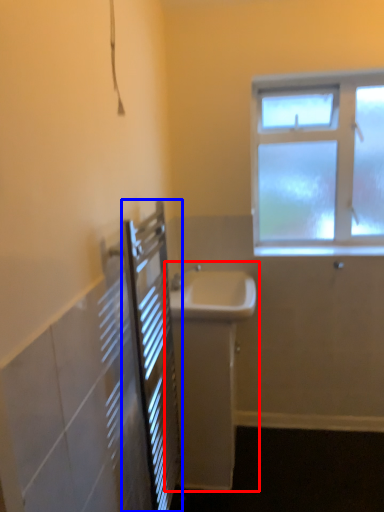
Question: Which object is further to the camera taking this photo, sink (highlighted by a red box) or screen door (highlighted by a blue box)?

Choices:
 (A) sink
 (B) screen door

Answer: (A)